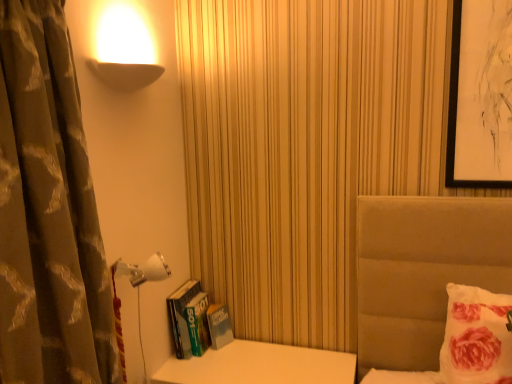
You are a GUI agent. You are given a task and a screenshot of the screen. Output one action in this format:
    pyautogui.click(x=<x>, y=<y>)
    Task: Click on the free spot below hardcover book at left (from a real-world perspective)
    
    Given the screenshot: What is the action you would take?
    pyautogui.click(x=207, y=356)